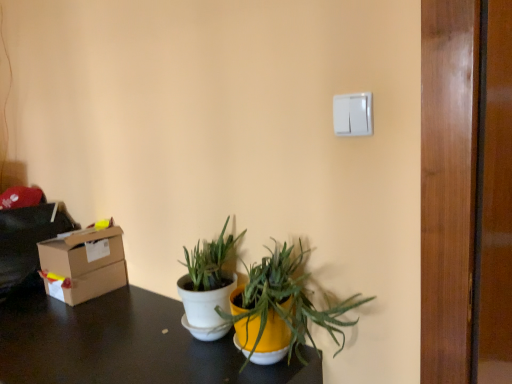
You are a GUI agent. You are given a task and a screenshot of the screen. Output one action in this format:
    pyautogui.click(x=<x>, y=<y>)
    Task: Click on the matte black desk at lower center
    Image resolution: width=512 pixels, height=384 pixels.
    Given the screenshot: What is the action you would take?
    pyautogui.click(x=124, y=345)

This screenshot has height=384, width=512. What do you see at coordinates (283, 304) in the screenshot?
I see `white matte pot at center, the second houseplant in the left-to-right sequence` at bounding box center [283, 304].

Find the location of a particular element. white matte pot at center, the 2th houseplant in the right-to-left sequence is located at coordinates (207, 286).

The image size is (512, 384). What do you see at coordinates (353, 114) in the screenshot? I see `white plastic light switch at upper right` at bounding box center [353, 114].

At what (x,y) coordinates should I click in order to perform the action: click on matte black desk at lower center. Please return your answer as a coordinate pair (x, y). The height and width of the screenshot is (384, 512). Looking at the image, I should click on (124, 345).

Is matte black desk at lower center outside of white plastic light switch at upper right?

Absolutely, matte black desk at lower center is external to white plastic light switch at upper right.

Is matte black desk at lower center taller or shorter than white plastic light switch at upper right?

In the image, matte black desk at lower center appears to be taller than white plastic light switch at upper right.

Is point (159, 326) positioned in front of point (345, 109)?

No, it is not.

From the image's perspective, relative to white plastic light switch at upper right, is matte black desk at lower center above or below?

matte black desk at lower center is below white plastic light switch at upper right.

Is cardboard box at left surrounded by white matte pot at center, the first houseplant when ordered from left to right?

A: No, cardboard box at left is not inside white matte pot at center, the first houseplant when ordered from left to right.

Is white matte pot at center, the first houseplant when ordered from left to right, at the right side of cardboard box at left?

Yes.

From the image's perspective, does white matte pot at center, the 2th houseplant in the right-to-left sequence, appear lower than cardboard box at left?

Actually, white matte pot at center, the 2th houseplant in the right-to-left sequence, appears above cardboard box at left in the image.

Is white matte pot at center, the first houseplant when ordered from left to right, turned away from cardboard box at left?

white matte pot at center, the first houseplant when ordered from left to right, is not turned away from cardboard box at left.

Is cardboard box at left not close to white matte pot at center, the second houseplant in the left-to-right sequence?

No, there isn't a large distance between cardboard box at left and white matte pot at center, the second houseplant in the left-to-right sequence.

Based on their positions, is cardboard box at left located to the left or right of white matte pot at center, the second houseplant in the left-to-right sequence?

cardboard box at left is positioned on white matte pot at center, the second houseplant in the left-to-right sequence,'s left side.

Does cardboard box at left have a greater width compared to white matte pot at center, arranged as the 1th houseplant when viewed from the right?

No, cardboard box at left is not wider than white matte pot at center, arranged as the 1th houseplant when viewed from the right.

Considering the sizes of objects cardboard box at left and matte black desk at lower center in the image provided, who is taller, cardboard box at left or matte black desk at lower center?

Standing taller between the two is matte black desk at lower center.

Does cardboard box at left have a larger size compared to matte black desk at lower center?

No, cardboard box at left is not bigger than matte black desk at lower center.

The image size is (512, 384). I want to click on box located above the matte black desk at lower center (from the image's perspective), so [x=83, y=264].

Which object is positioned more to the right, cardboard box at left or matte black desk at lower center?

matte black desk at lower center.

From the image's perspective, is matte black desk at lower center under cardboard box at left?

Correct, matte black desk at lower center appears lower than cardboard box at left in the image.

Is matte black desk at lower center spatially inside cardboard box at left, or outside of it?

matte black desk at lower center is not enclosed by cardboard box at left.

Is matte black desk at lower center closer to the viewer compared to cardboard box at left?

Yes, matte black desk at lower center is in front of cardboard box at left.

Is there a large distance between matte black desk at lower center and cardboard box at left?

No, matte black desk at lower center is not far from cardboard box at left.

Considering the relative positions of white matte pot at center, the second houseplant in the left-to-right sequence, and matte black desk at lower center in the image provided, is white matte pot at center, the second houseplant in the left-to-right sequence, to the right of matte black desk at lower center from the viewer's perspective?

Yes, white matte pot at center, the second houseplant in the left-to-right sequence, is to the right of matte black desk at lower center.

Considering the relative sizes of white matte pot at center, arranged as the 1th houseplant when viewed from the right, and matte black desk at lower center in the image provided, is white matte pot at center, arranged as the 1th houseplant when viewed from the right, wider than matte black desk at lower center?

No.

Is there a large distance between white matte pot at center, arranged as the 1th houseplant when viewed from the right, and matte black desk at lower center?

No, white matte pot at center, arranged as the 1th houseplant when viewed from the right, is in close proximity to matte black desk at lower center.

Based on the photo, between cardboard box at left and white plastic light switch at upper right, which one appears on the left side from the viewer's perspective?

Positioned to the left is cardboard box at left.

Can you confirm if cardboard box at left is smaller than white plastic light switch at upper right?

No, cardboard box at left is not smaller than white plastic light switch at upper right.

Is white plastic light switch at upper right completely or partially inside cardboard box at left?

No, white plastic light switch at upper right is not inside cardboard box at left.

Can you tell me how much cardboard box at left and white plastic light switch at upper right differ in facing direction?

The facing directions of cardboard box at left and white plastic light switch at upper right are 4.34 degrees apart.

Identify the location of light switch located on the right of matte black desk at lower center. Image resolution: width=512 pixels, height=384 pixels. (353, 114).

Locate an element on the screen. The image size is (512, 384). box behind the white matte pot at center, the 2th houseplant in the right-to-left sequence is located at coordinates (83, 264).

Looking at the image, which one is located closer to white plastic light switch at upper right, cardboard box at left or matte black desk at lower center?

matte black desk at lower center is closer to white plastic light switch at upper right.

Looking at the image, which one is located closer to matte black desk at lower center, white matte pot at center, the second houseplant in the left-to-right sequence, or white matte pot at center, the first houseplant when ordered from left to right?

white matte pot at center, the first houseplant when ordered from left to right, lies closer to matte black desk at lower center than the other object.

Looking at this image, when comparing their distances from white matte pot at center, the first houseplant when ordered from left to right, does matte black desk at lower center or white plastic light switch at upper right seem further?

The object further to white matte pot at center, the first houseplant when ordered from left to right, is white plastic light switch at upper right.

Based on their spatial positions, is white plastic light switch at upper right or cardboard box at left further from white matte pot at center, the second houseplant in the left-to-right sequence?

cardboard box at left.

Based on their spatial positions, is white plastic light switch at upper right or cardboard box at left further from white matte pot at center, the first houseplant when ordered from left to right?

white plastic light switch at upper right lies further to white matte pot at center, the first houseplant when ordered from left to right, than the other object.

When comparing their distances from white plastic light switch at upper right, does cardboard box at left or white matte pot at center, the 2th houseplant in the right-to-left sequence, seem closer?

white matte pot at center, the 2th houseplant in the right-to-left sequence, is closer to white plastic light switch at upper right.

Based on their spatial positions, is white plastic light switch at upper right or white matte pot at center, the 2th houseplant in the right-to-left sequence, further from white matte pot at center, arranged as the 1th houseplant when viewed from the right?

Among the two, white plastic light switch at upper right is located further to white matte pot at center, arranged as the 1th houseplant when viewed from the right.

Looking at the image, which one is located further to white plastic light switch at upper right, matte black desk at lower center or white matte pot at center, the first houseplant when ordered from left to right?

matte black desk at lower center is positioned further to the anchor white plastic light switch at upper right.

Where is `houseplant between white plastic light switch at upper right and white matte pot at center, the first houseplant when ordered from left to right, in the up-down direction`? houseplant between white plastic light switch at upper right and white matte pot at center, the first houseplant when ordered from left to right, in the up-down direction is located at coordinates (283, 304).

Locate an element on the screen. This screenshot has width=512, height=384. houseplant between cardboard box at left and white matte pot at center, arranged as the 1th houseplant when viewed from the right, in the horizontal direction is located at coordinates (207, 286).

Identify the location of desk between cardboard box at left and white matte pot at center, arranged as the 1th houseplant when viewed from the right, in the horizontal direction. (124, 345).

Find the location of `houseplant between matte black desk at lower center and white matte pot at center, arranged as the 1th houseplant when viewed from the right, in the horizontal direction`. houseplant between matte black desk at lower center and white matte pot at center, arranged as the 1th houseplant when viewed from the right, in the horizontal direction is located at coordinates (207, 286).